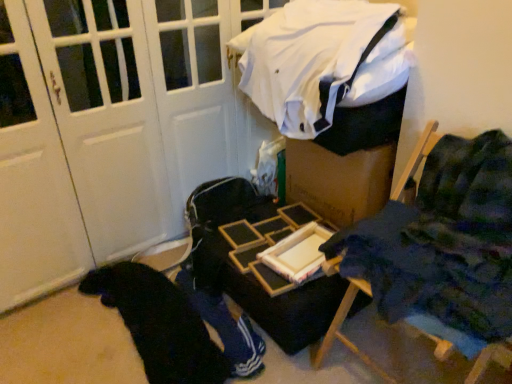
Question: From the image's perspective, is wooden tray at center positioned above or below white fabric at upper center?

Choices:
 (A) above
 (B) below

Answer: (B)

Question: In terms of size, does wooden tray at center appear bigger or smaller than white fabric at upper center?

Choices:
 (A) small
 (B) big

Answer: (A)

Question: Based on their relative distances, which object is nearer to the white fabric at upper center?

Choices:
 (A) blue fabric chair at right
 (B) wooden tray at center
 (C) black fabric at lower left

Answer: (B)

Question: Estimate the real-world distances between objects in this image. Which object is farther from the blue fabric chair at right?

Choices:
 (A) white fabric at upper center
 (B) wooden tray at center
 (C) black fabric at lower left

Answer: (A)